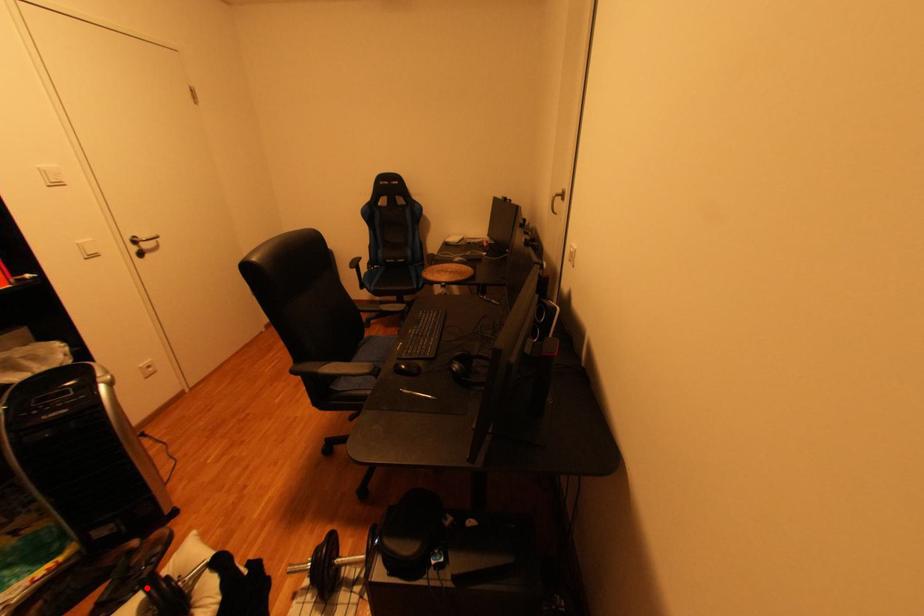
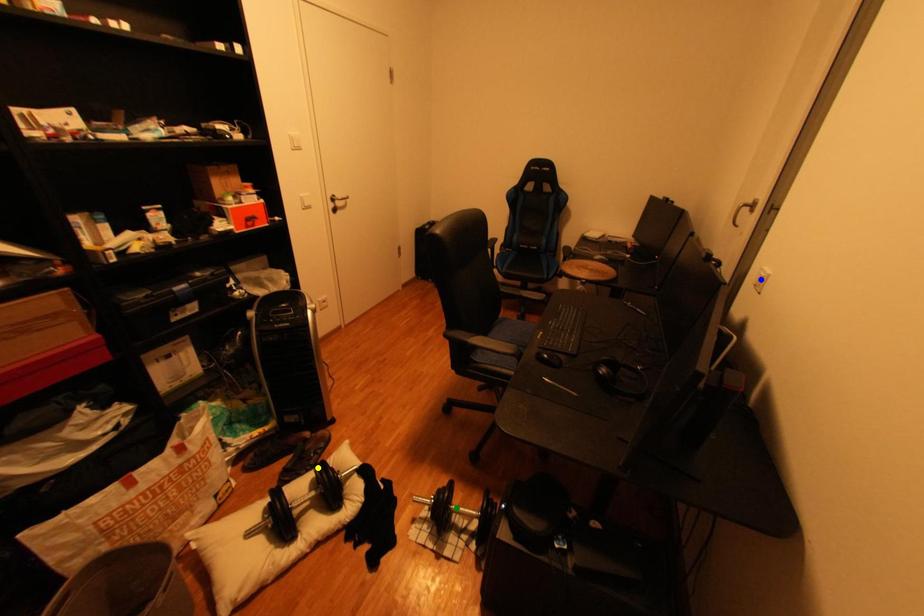
Question: I am providing you with two images of the same scene from different viewpoints. A red point is marked on the first image. You are given multiple points on the second image. Which point in image 2 is actually the same real-world point as the red point in image 1?

Choices:
 (A) blue point
 (B) green point
 (C) yellow point

Answer: (C)